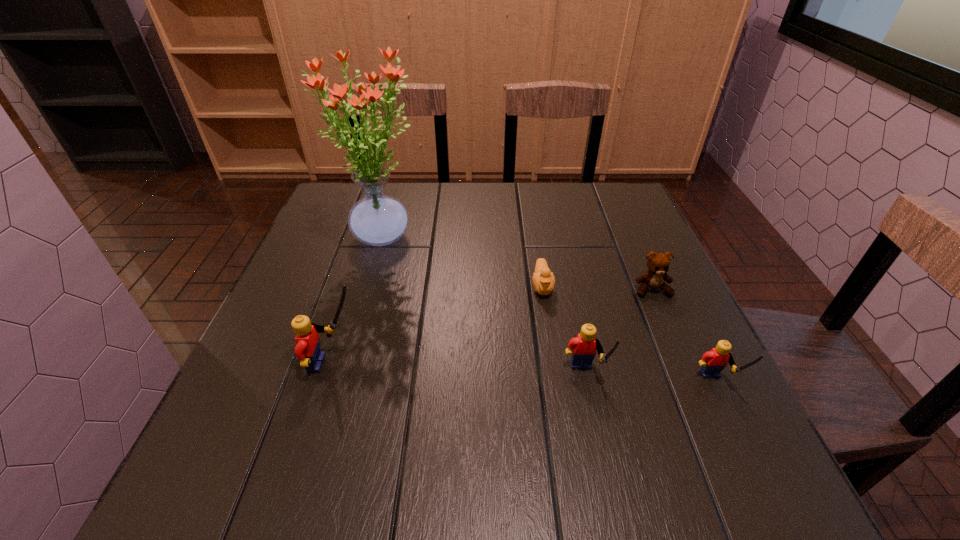
This screenshot has width=960, height=540. I want to click on the leftmost Lego, so click(307, 340).

Where is `the second Lego from left to right`? The width and height of the screenshot is (960, 540). the second Lego from left to right is located at coordinates (584, 346).

You are a GUI agent. You are given a task and a screenshot of the screen. Output one action in this format:
    pyautogui.click(x=<x>, y=<y>)
    Task: Click on the second shortest Lego
    
    Given the screenshot: What is the action you would take?
    pyautogui.click(x=584, y=346)

Locate an element on the screen. the rightmost Lego is located at coordinates (713, 362).

You are a GUI agent. You are given a task and a screenshot of the screen. Output one action in this format:
    pyautogui.click(x=<x>, y=<y>)
    Task: Click on the shortest Lego
    This screenshot has width=960, height=540.
    Given the screenshot: What is the action you would take?
    pyautogui.click(x=713, y=362)

Where is `the shortest object`? the shortest object is located at coordinates (543, 280).

Locate an element on the screen. Image resolution: width=960 pixels, height=540 pixels. flower arrangement is located at coordinates (377, 219).

What are the coordinates of `the tallest object` in the screenshot? It's located at (377, 219).

I want to click on the fifth tallest object, so click(658, 264).

Image resolution: width=960 pixels, height=540 pixels. Identify the location of free point located on the front-facing side of the leftmost Lego. (391, 363).